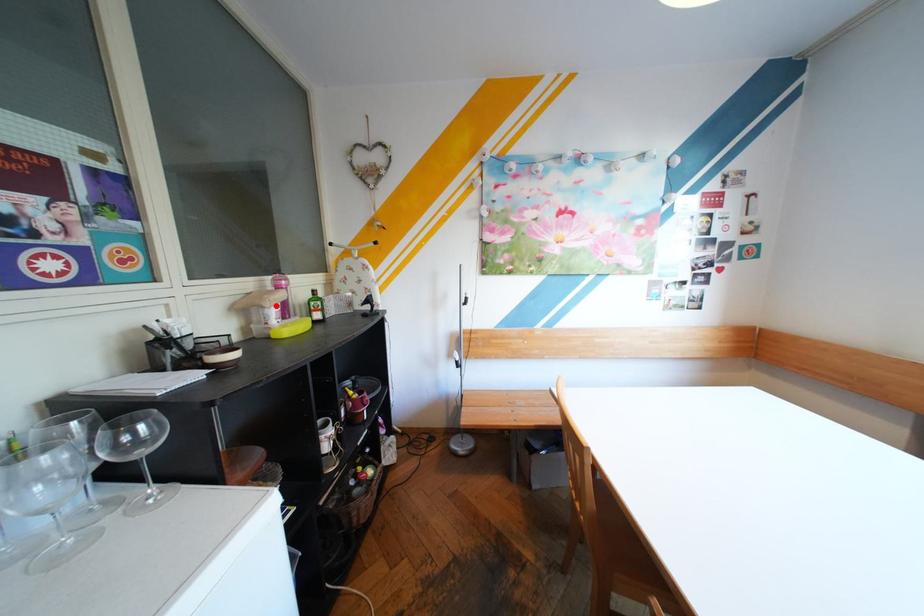
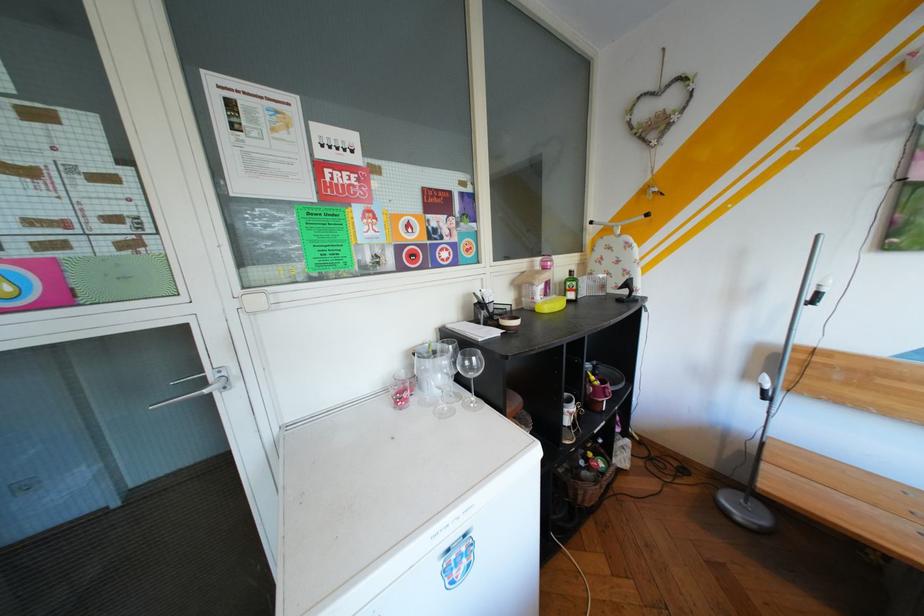
Locate, in the second image, the point that corresponds to the highlighted location in the first image.

(545, 284)